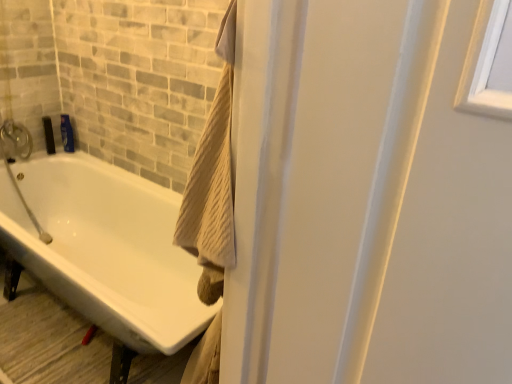
Question: Is blue glossy shampoo bottle at upper left far from white glossy bathtub at lower left?

Choices:
 (A) yes
 (B) no

Answer: (B)

Question: From a real-world perspective, is blue glossy shampoo bottle at upper left over white glossy bathtub at lower left?

Choices:
 (A) yes
 (B) no

Answer: (A)

Question: Can you confirm if blue glossy shampoo bottle at upper left is wider than white glossy bathtub at lower left?

Choices:
 (A) yes
 (B) no

Answer: (B)

Question: Does blue glossy shampoo bottle at upper left have a smaller size compared to white glossy bathtub at lower left?

Choices:
 (A) yes
 (B) no

Answer: (A)

Question: Does blue glossy shampoo bottle at upper left have a lesser height compared to white glossy bathtub at lower left?

Choices:
 (A) yes
 (B) no

Answer: (A)

Question: Is blue glossy shampoo bottle at upper left oriented away from white glossy bathtub at lower left?

Choices:
 (A) yes
 (B) no

Answer: (B)

Question: Does white glossy bathtub at lower left have a greater height compared to blue glossy shampoo bottle at upper left?

Choices:
 (A) no
 (B) yes

Answer: (B)

Question: Would you say blue glossy shampoo bottle at upper left is part of white glossy bathtub at lower left's contents?

Choices:
 (A) no
 (B) yes

Answer: (A)

Question: Could you tell me if white glossy bathtub at lower left is facing blue glossy shampoo bottle at upper left?

Choices:
 (A) no
 (B) yes

Answer: (A)

Question: Can you confirm if white glossy bathtub at lower left is smaller than blue glossy shampoo bottle at upper left?

Choices:
 (A) yes
 (B) no

Answer: (B)

Question: From the image's perspective, is white glossy bathtub at lower left beneath blue glossy shampoo bottle at upper left?

Choices:
 (A) yes
 (B) no

Answer: (A)

Question: Is white glossy bathtub at lower left touching blue glossy shampoo bottle at upper left?

Choices:
 (A) no
 (B) yes

Answer: (A)

Question: Considering the positions of point (70, 134) and point (12, 200), is point (70, 134) closer or farther from the camera than point (12, 200)?

Choices:
 (A) closer
 (B) farther

Answer: (B)